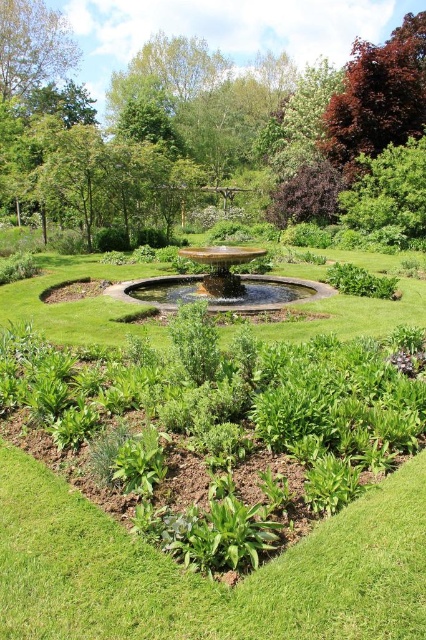
Question: Is purple leafy tree at upper center to the right of gold polished water at center from the viewer's perspective?

Choices:
 (A) no
 (B) yes

Answer: (A)

Question: Among these points, which one is nearest to the camera?

Choices:
 (A) (425, 120)
 (B) (14, 81)

Answer: (A)

Question: Which object appears farthest from the camera in this image?

Choices:
 (A) gold polished water at center
 (B) gold metallic fountain at center
 (C) purple leafy tree at upper center

Answer: (C)

Question: Is purple leafy tree at upper center to the right of purple-leaved tree at upper right from the viewer's perspective?

Choices:
 (A) no
 (B) yes

Answer: (A)

Question: Which is farther from the gold polished water at center?

Choices:
 (A) green leafy tree at upper left
 (B) gold metallic fountain at center
 (C) purple leafy tree at upper center
 (D) purple-leaved tree at upper right

Answer: (A)

Question: Observing the image, what is the correct spatial positioning of purple-leaved tree at upper right in reference to green leafy tree at upper left?

Choices:
 (A) above
 (B) below

Answer: (A)